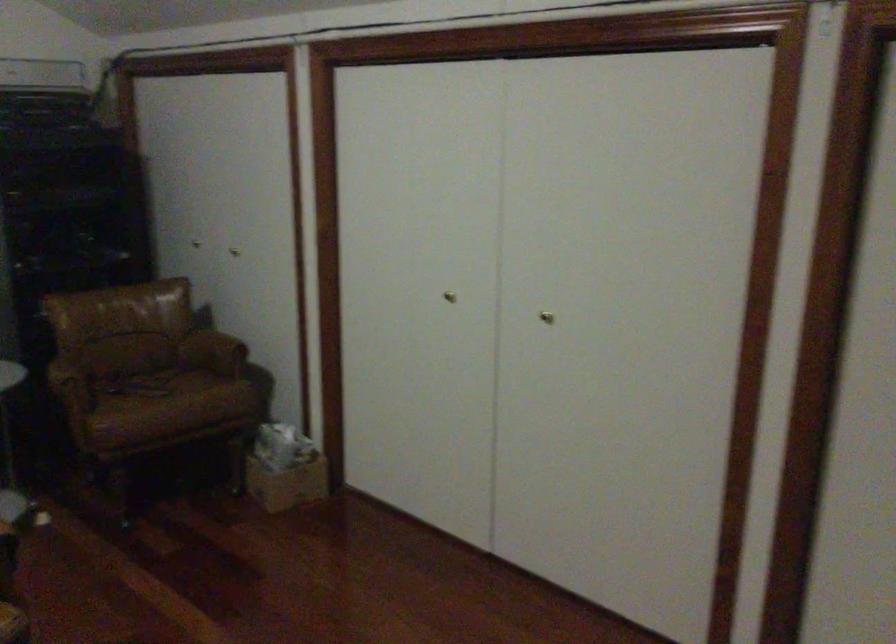
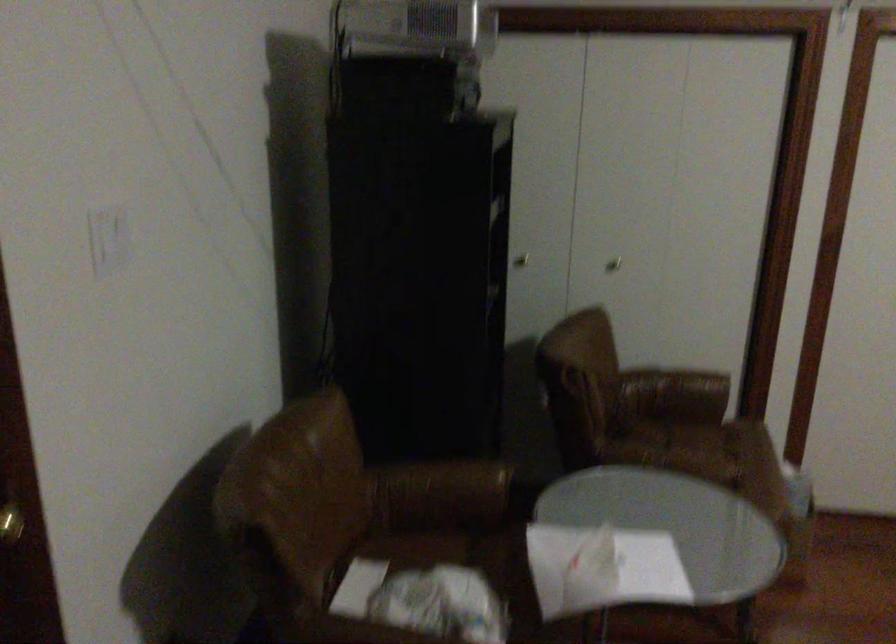
Where in the second image is the point corresponding to [202,388] from the first image?

(718, 442)